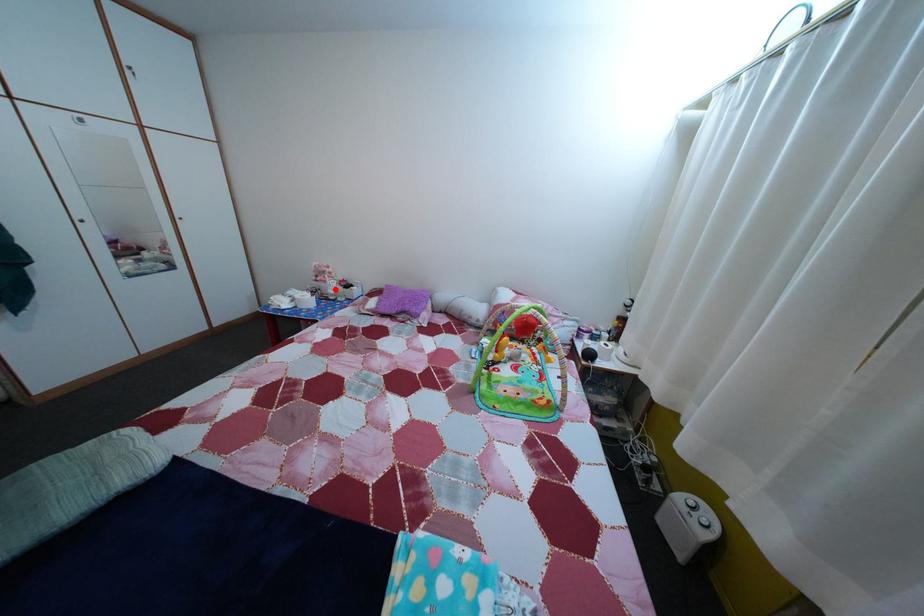
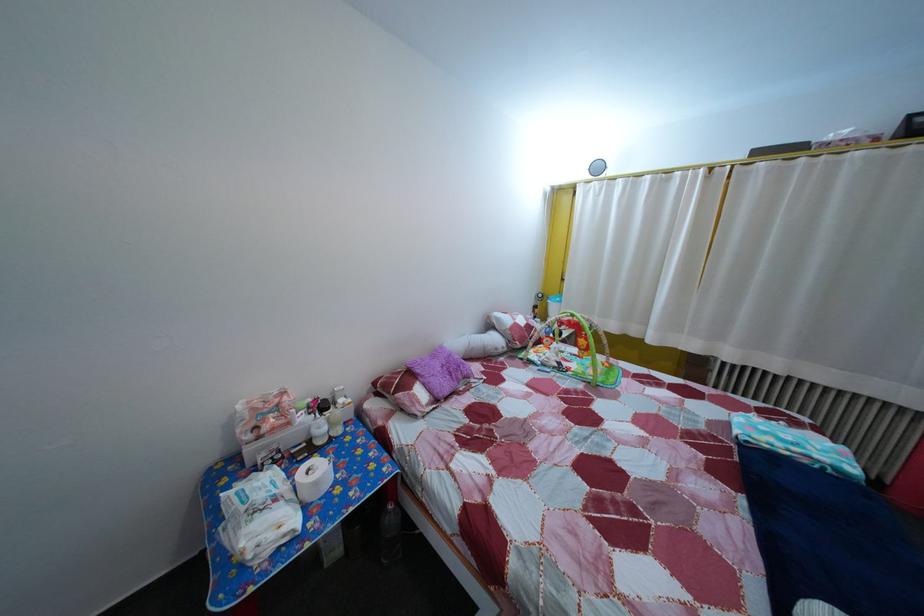
Locate, in the second image, the point that corresponds to the highlighted location in the first image.

(298, 432)